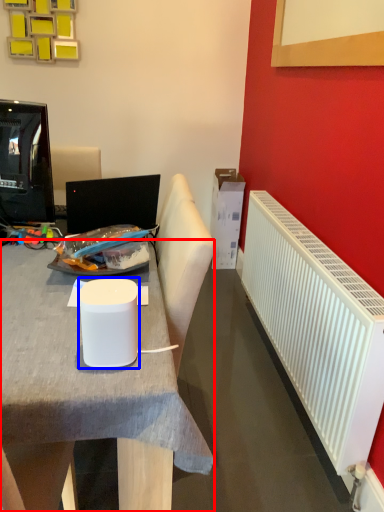
Question: Which point is closer to the camera, desk (highlighted by a red box) or paper cup (highlighted by a blue box)?

Choices:
 (A) desk
 (B) paper cup

Answer: (B)